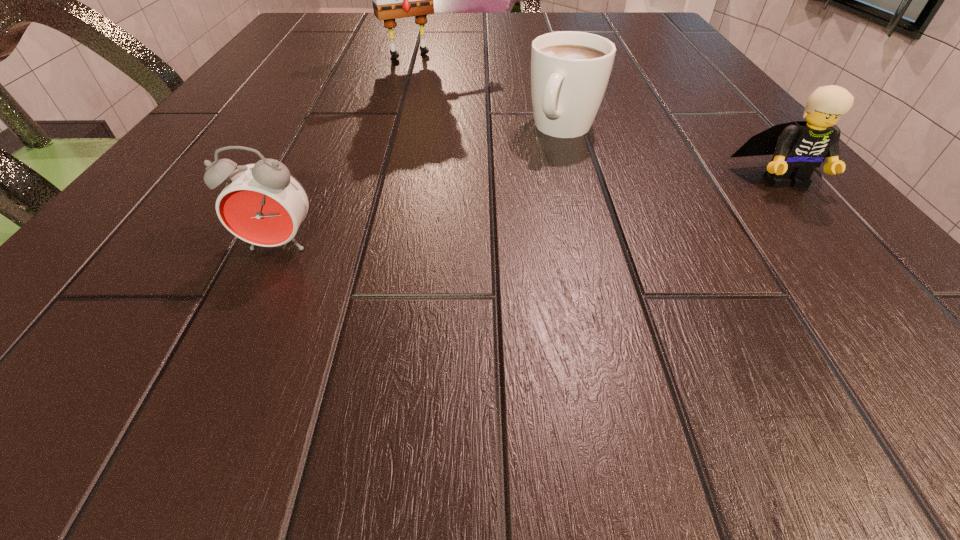
Where is `alarm clock`? The height and width of the screenshot is (540, 960). alarm clock is located at coordinates (262, 203).

Where is `the third farthest object`? This screenshot has height=540, width=960. the third farthest object is located at coordinates (798, 148).

Identify the location of the rightmost object. (798, 148).

I want to click on the second farthest object, so click(x=570, y=70).

The image size is (960, 540). I want to click on the second object from right to left, so click(x=570, y=70).

Where is `the farthest object`? This screenshot has width=960, height=540. the farthest object is located at coordinates (391, 0).

Where is `sponge`? This screenshot has width=960, height=540. sponge is located at coordinates (391, 0).

Where is `free space located on the front-facing side of the Lego`? This screenshot has width=960, height=540. free space located on the front-facing side of the Lego is located at coordinates (821, 224).

The width and height of the screenshot is (960, 540). Identify the location of free space located with the handle on the side of the third nearest object. (512, 210).

This screenshot has height=540, width=960. I want to click on blank space located with the handle on the side of the third nearest object, so click(x=520, y=197).